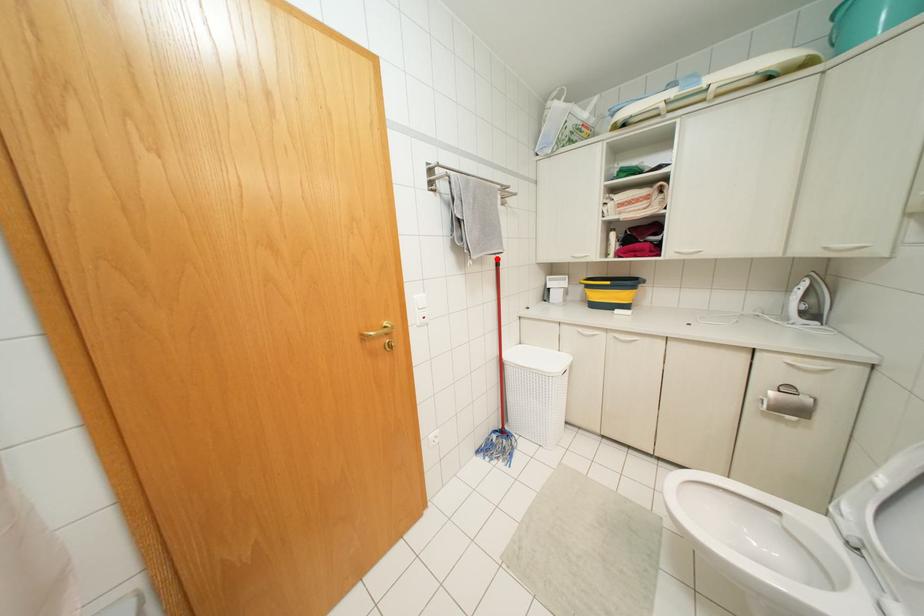
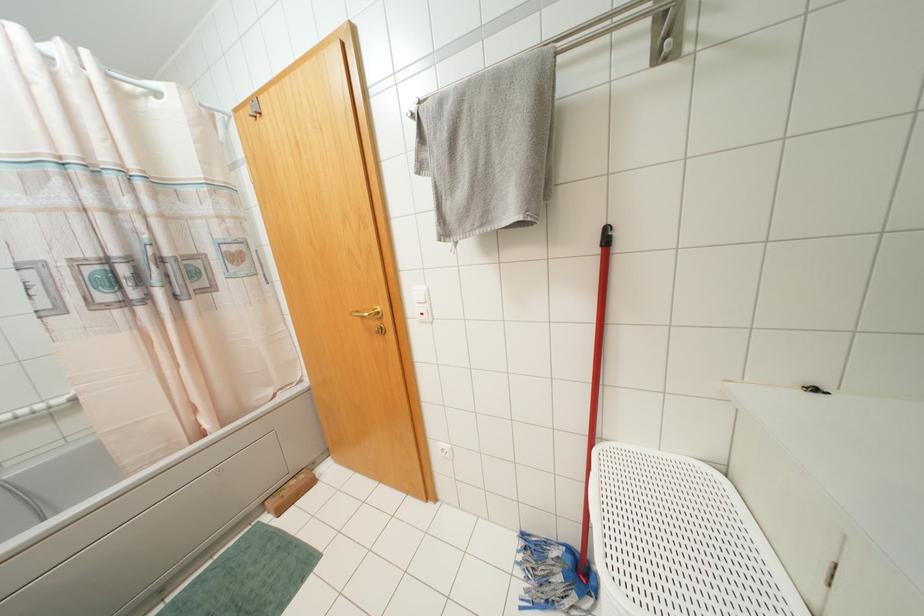
Locate, in the second image, the point that corresponds to the highlighted location in the first image.

(606, 229)